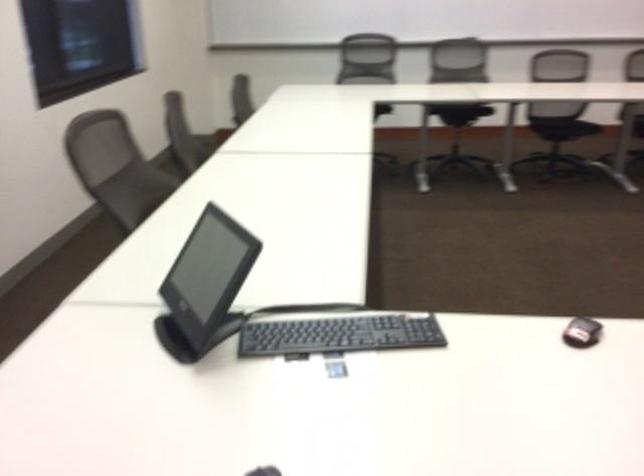
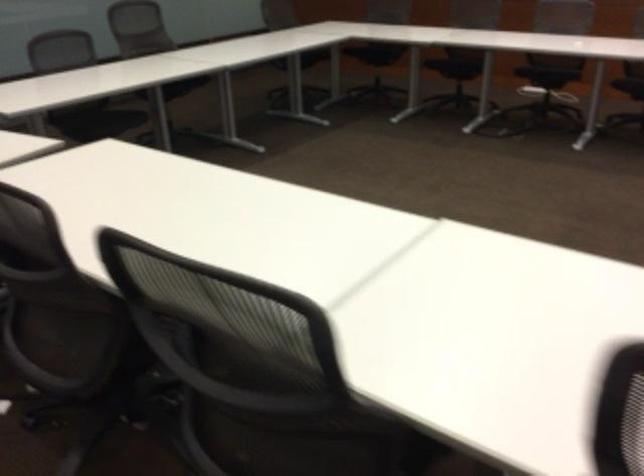
The first image is from the beginning of the video and the second image is from the end. How did the camera likely rotate when shooting the video?

The rotation direction of the camera is right-down.